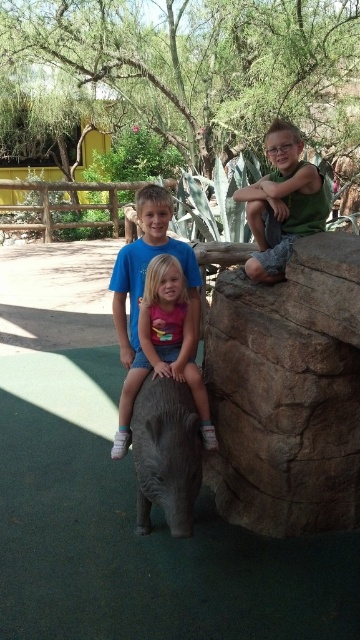
Question: Which point is closer to the camera taking this photo?

Choices:
 (A) (155, 259)
 (B) (146, 419)
 (C) (221, 307)

Answer: (B)

Question: Which of the following is the closest to the observer?

Choices:
 (A) (147, 436)
 (B) (164, 268)

Answer: (A)

Question: Can you confirm if green matte shirt at upper right is smaller than pink fabric shirt at center?

Choices:
 (A) yes
 (B) no

Answer: (B)

Question: Which point appears farthest from the camera in this image?

Choices:
 (A) (182, 445)
 (B) (248, 266)
 (C) (142, 296)
 (D) (209, 458)

Answer: (D)

Question: In this image, where is gray matte elephant at center located relative to green matte shirt at upper right?

Choices:
 (A) above
 (B) below

Answer: (B)

Question: Is gray matte elephant at center below pink fabric shirt at center?

Choices:
 (A) yes
 (B) no

Answer: (A)